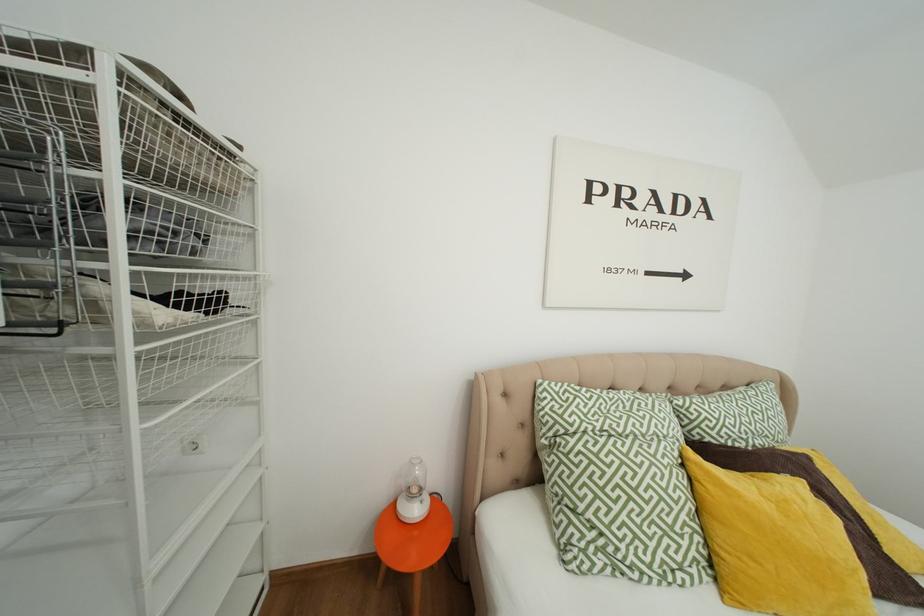
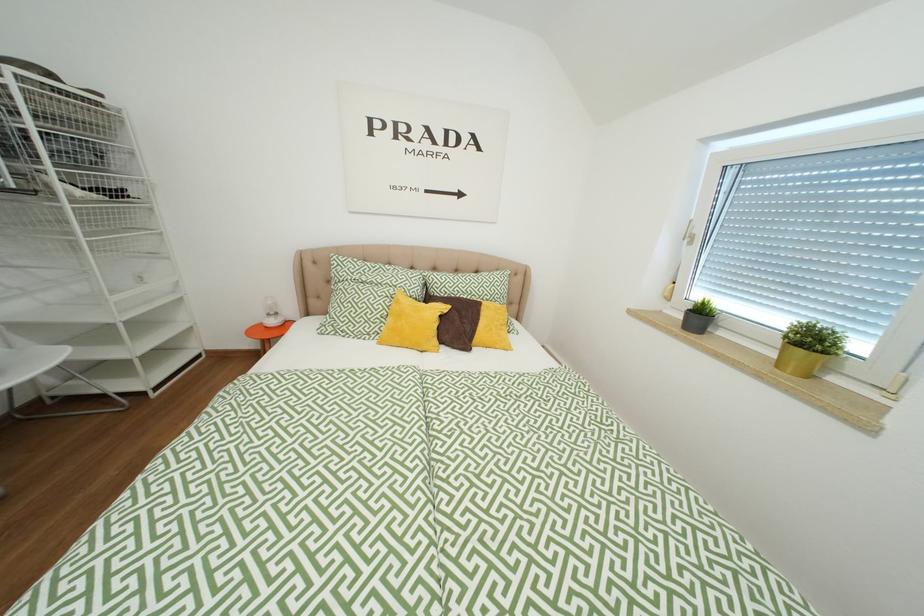
What movement of the cameraman would produce the second image?

The cameraman moved toward right, backward.